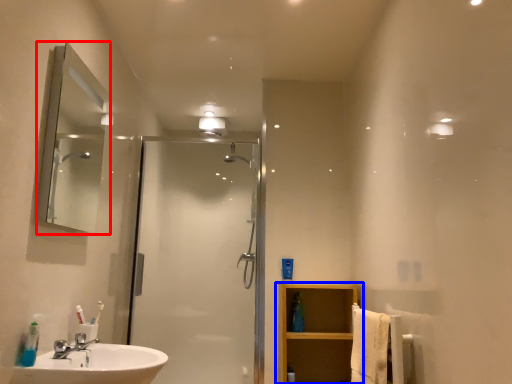
Question: Which object appears closest to the camera in this image, mirror (highlighted by a red box) or bathroom cabinet (highlighted by a blue box)?

Choices:
 (A) mirror
 (B) bathroom cabinet

Answer: (A)